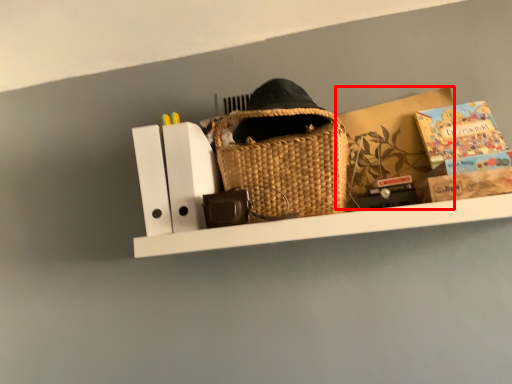
Question: Where is cardboard box (annotated by the red box) located in relation to paperback book in the image?

Choices:
 (A) left
 (B) right

Answer: (A)